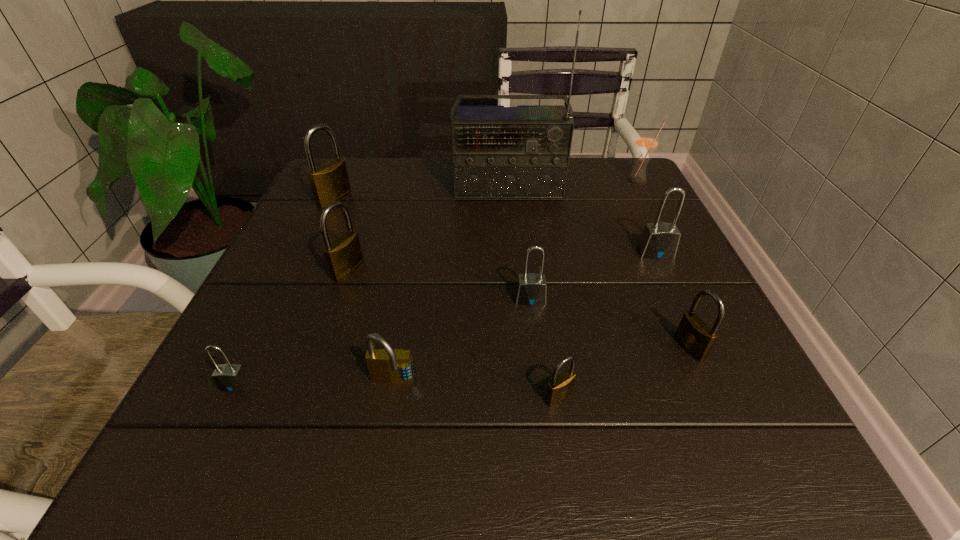
Identify the location of free space between the fifth padlock from right to left and the third brass padlock from left to right. (476, 390).

Where is `vacant area between the second brass padlock from right to left and the leftmost gray padlock`? vacant area between the second brass padlock from right to left and the leftmost gray padlock is located at coordinates (396, 391).

Image resolution: width=960 pixels, height=540 pixels. What are the coordinates of `free area in between the fourth padlock from left to right and the tallest padlock` in the screenshot? It's located at (364, 291).

Where is `vacant space that's between the fifth padlock from right to left and the tallest padlock`? Image resolution: width=960 pixels, height=540 pixels. vacant space that's between the fifth padlock from right to left and the tallest padlock is located at coordinates (364, 291).

The image size is (960, 540). I want to click on vacant point located between the farthest gray padlock and the radio receiver, so click(582, 221).

The width and height of the screenshot is (960, 540). I want to click on empty space that is in between the rightmost brass padlock and the third smallest brass padlock, so click(518, 309).

Locate an element on the screen. The image size is (960, 540). vacant region between the leftmost brass padlock and the farthest gray padlock is located at coordinates (495, 226).

What are the coordinates of `unoccupied position between the third object from left to right and the smallest brass padlock` in the screenshot? It's located at (453, 334).

Image resolution: width=960 pixels, height=540 pixels. Identify the location of vacant space that is in between the second biggest gray padlock and the third padlock from left to right. (439, 285).

In order to click on the fourth closest object to the straw in this screenshot , I will do `click(695, 336)`.